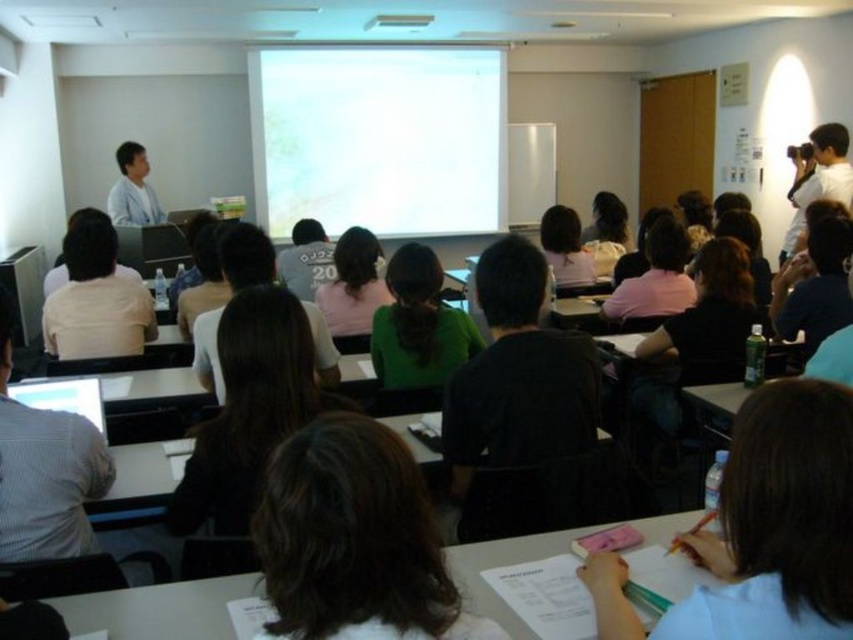
Question: Is dark brown hair at center below white shirt at left?

Choices:
 (A) no
 (B) yes

Answer: (B)

Question: Where is dark brown hair at center located in relation to green matte shirt at center in the image?

Choices:
 (A) right
 (B) left

Answer: (A)

Question: Estimate the real-world distances between objects in this image. Which object is closer to the white shirt at left?

Choices:
 (A) white paper at center
 (B) green matte shirt at center
 (C) dark brown hair at center

Answer: (B)

Question: Which object is the farthest from the white shirt at left?

Choices:
 (A) dark brown hair at center
 (B) green matte shirt at center
 (C) white paper at center

Answer: (C)

Question: Is white paper at center thinner than dark brown hair at center?

Choices:
 (A) yes
 (B) no

Answer: (A)

Question: Which point appears farthest from the camera in this image?

Choices:
 (A) (730, 636)
 (B) (329, 456)
 (C) (141, 186)

Answer: (C)